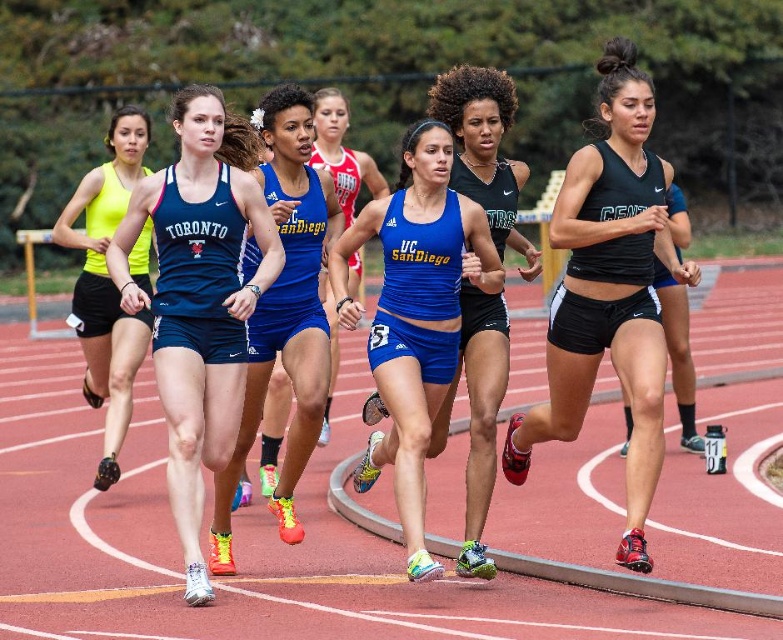
From the picture: You are a photographer standing at the starting line of the track and want to capture a closeup shot of the blue matte tank top at center. Given that your camera has a minimum focusing distance of 5 meters, will you be able to take the photo without moving closer?

The blue matte tank top at center is 6.82 meters away from viewer, which is beyond the camera minimum focusing distance of 5 meters. Therefore, you can take the photo without moving closer.

Consider the image. You are a photographer at the track event. You want to capture a photo of both the blue matte tank top at center and the blue fabric uniform at center. Which one should you adjust your camera focus to first to ensure both are in the frame?

The blue matte tank top at center is to the right of blue fabric uniform at center. Since the blue matte tank top at center is positioned further to the right, you should first focus on the blue fabric uniform at center to ensure the entire span between them fits within the frame.